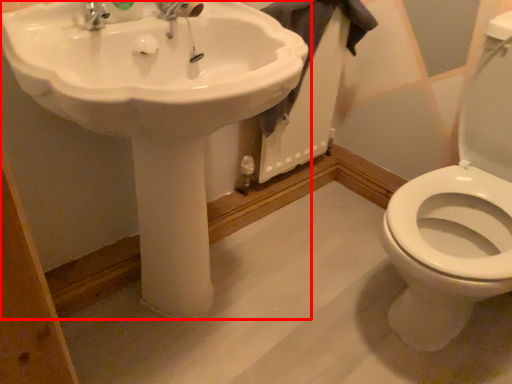
Question: From the image's perspective, considering the relative positions of sink (annotated by the red box) and bath towel in the image provided, where is sink (annotated by the red box) located with respect to the staircase?

Choices:
 (A) above
 (B) below

Answer: (B)